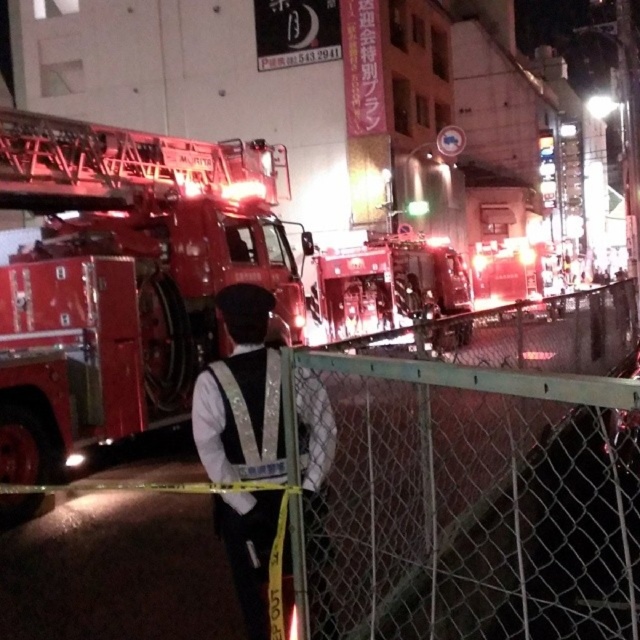
Question: Is shiny red fire truck at center below shiny metallic fire truck at center?

Choices:
 (A) yes
 (B) no

Answer: (A)

Question: Which of the following is the farthest from the observer?

Choices:
 (A) shiny red fire truck at center
 (B) white reflective vest at center
 (C) shiny metallic fire truck at center

Answer: (C)

Question: Which of these objects is positioned closest to the shiny metallic fire truck at center?

Choices:
 (A) white reflective vest at center
 (B) shiny red fire truck at center

Answer: (B)

Question: Can you confirm if shiny red fire truck at center is positioned above white reflective vest at center?

Choices:
 (A) yes
 (B) no

Answer: (A)

Question: Among these points, which one is farthest from the camera?

Choices:
 (A) (164, 152)
 (B) (348, 317)

Answer: (B)

Question: Observing the image, what is the correct spatial positioning of white reflective vest at center in reference to shiny metallic fire truck at center?

Choices:
 (A) below
 (B) above

Answer: (A)